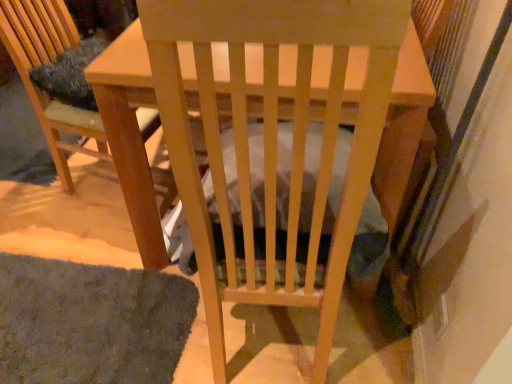
Question: Is green shaggy mat at lower left situated inside wooden chair at left or outside?

Choices:
 (A) outside
 (B) inside

Answer: (A)

Question: Based on their positions, is green shaggy mat at lower left located to the left or right of wooden chair at left?

Choices:
 (A) right
 (B) left

Answer: (B)

Question: Which object is the closest to the wooden table at center?

Choices:
 (A) wooden chair at left
 (B) green shaggy mat at lower left

Answer: (B)

Question: Estimate the real-world distances between objects in this image. Which object is farther from the wooden table at center?

Choices:
 (A) wooden chair at left
 (B) green shaggy mat at lower left

Answer: (A)